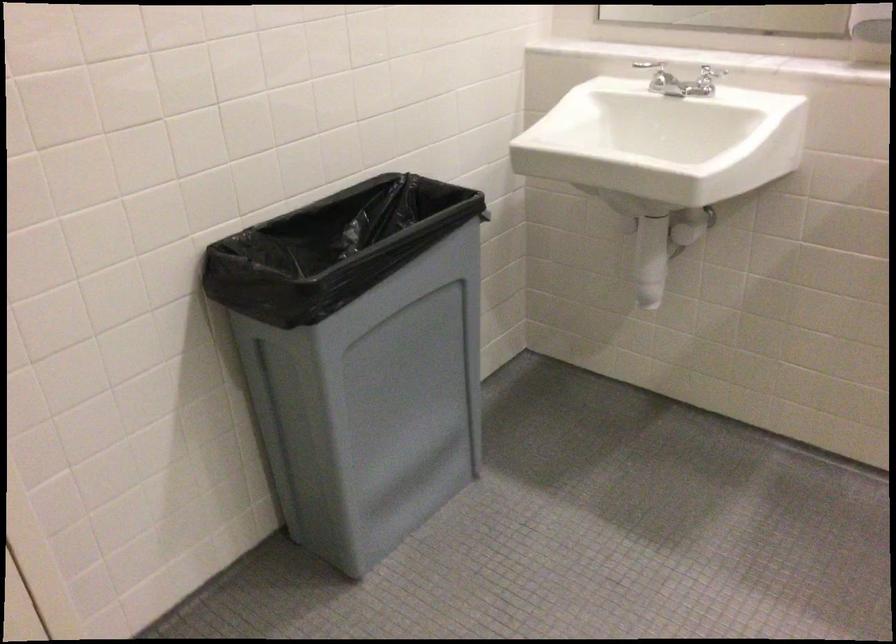
The images are taken continuously from a first-person perspective. In which direction is your viewpoint rotating?

The camera rotated toward right-down.